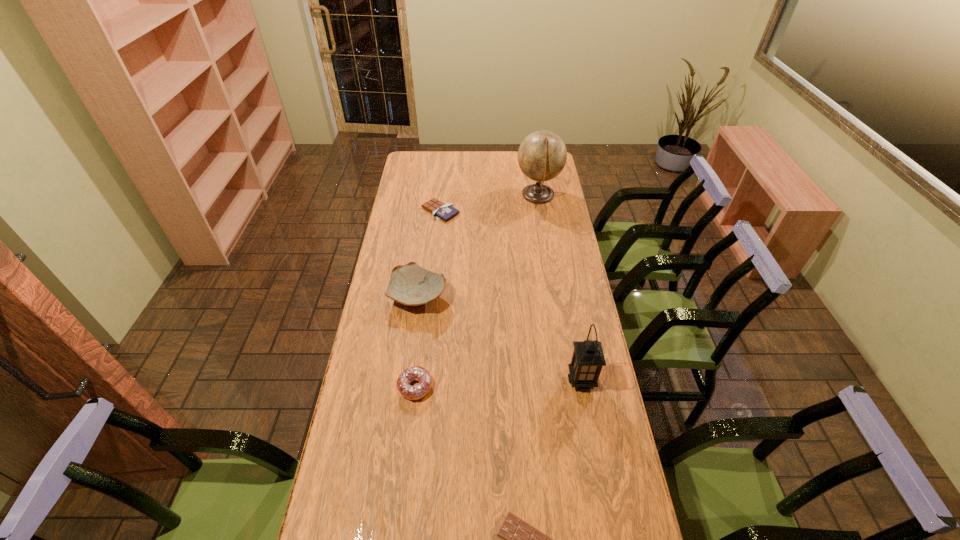
Locate an element on the screen. the fourth closest object relative to the tallest object is located at coordinates (418, 373).

At what (x,y) coordinates should I click in order to perform the action: click on vacant area that satisfies the following two spatial constraints: 1. on the front side of the pottery; 2. on the right side of the fourth tallest object. Please return your answer as a coordinate pair (x, y). The image size is (960, 540). Looking at the image, I should click on (406, 387).

Where is `vacant region that satisfies the following two spatial constraints: 1. on the front-facing side of the globe; 2. on the front side of the third farthest object`? vacant region that satisfies the following two spatial constraints: 1. on the front-facing side of the globe; 2. on the front side of the third farthest object is located at coordinates (555, 297).

Identify the location of vacant space that satisfies the following two spatial constraints: 1. on the front-facing side of the globe; 2. on the front side of the second shortest object. (540, 211).

Where is `vacant space that satisfies the following two spatial constraints: 1. on the front-facing side of the globe; 2. on the front side of the doughnut`? The height and width of the screenshot is (540, 960). vacant space that satisfies the following two spatial constraints: 1. on the front-facing side of the globe; 2. on the front side of the doughnut is located at coordinates (569, 387).